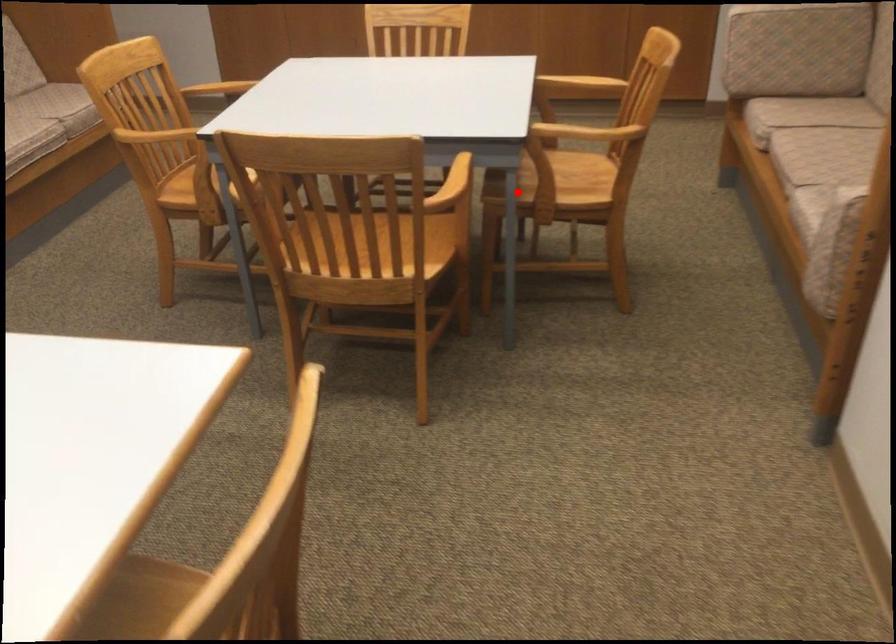
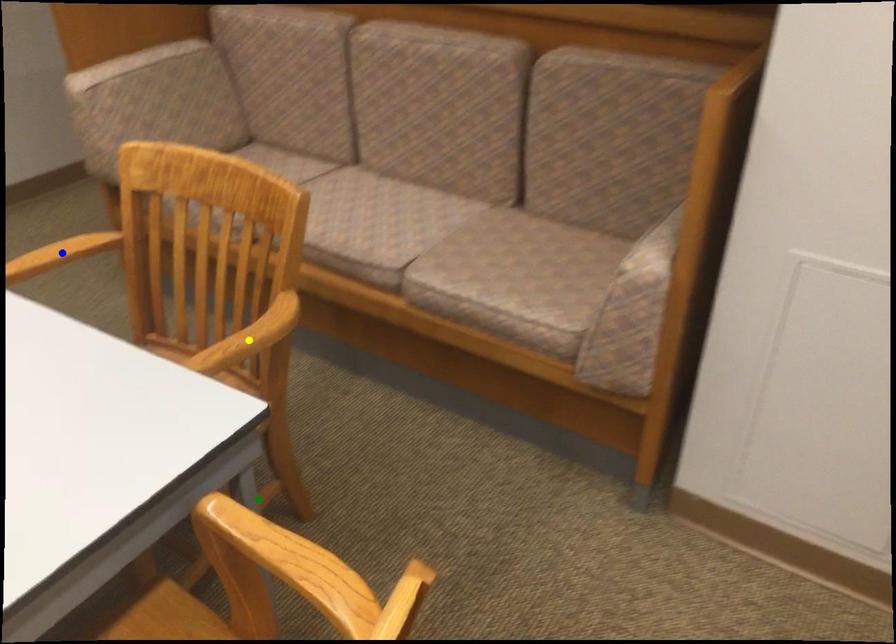
Question: I am providing you with two images of the same scene from different viewpoints. A red point is marked on the first image. You are given multiple points on the second image. Which spot in image 2 lines up with the point in image 1?

Choices:
 (A) yellow point
 (B) blue point
 (C) green point

Answer: (C)